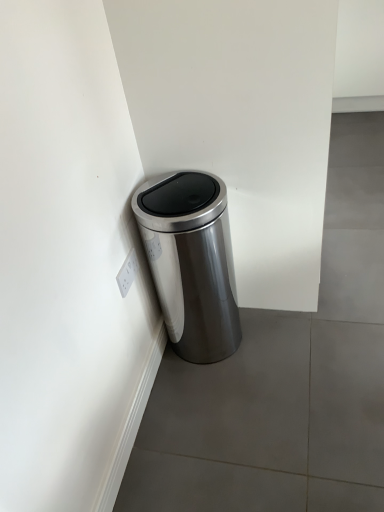
Question: From the image's perspective, is satin silver trash can at corner above or below white plastic electric outlet at lower left?

Choices:
 (A) above
 (B) below

Answer: (A)

Question: Which is correct: satin silver trash can at corner is inside white plastic electric outlet at lower left, or outside of it?

Choices:
 (A) outside
 (B) inside

Answer: (A)

Question: From a real-world perspective, relative to white plastic electric outlet at lower left, is satin silver trash can at corner vertically above or below?

Choices:
 (A) above
 (B) below

Answer: (B)

Question: Looking at their shapes, would you say white plastic electric outlet at lower left is wider or thinner than satin silver trash can at corner?

Choices:
 (A) wide
 (B) thin

Answer: (B)

Question: Considering the positions of white plastic electric outlet at lower left and satin silver trash can at corner in the image, is white plastic electric outlet at lower left bigger or smaller than satin silver trash can at corner?

Choices:
 (A) big
 (B) small

Answer: (B)

Question: Visually, is white plastic electric outlet at lower left positioned to the left or to the right of satin silver trash can at corner?

Choices:
 (A) right
 (B) left

Answer: (B)

Question: Is white plastic electric outlet at lower left spatially inside satin silver trash can at corner, or outside of it?

Choices:
 (A) outside
 (B) inside

Answer: (A)